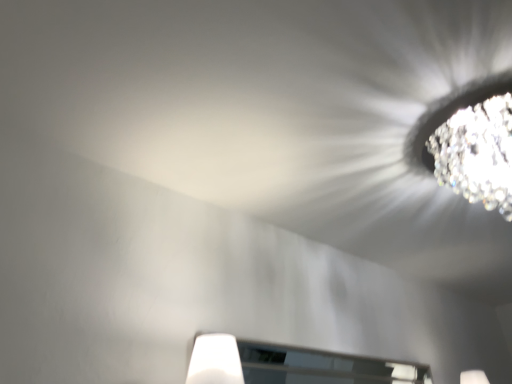
At what (x,y) coordinates should I click in order to perform the action: click on transparent glass window at lower center. Please return your answer as a coordinate pair (x, y). Looking at the image, I should click on (294, 364).

What do you see at coordinates (294, 364) in the screenshot? The height and width of the screenshot is (384, 512). I see `transparent glass window at lower center` at bounding box center [294, 364].

Identify the location of transparent glass window at lower center. (294, 364).